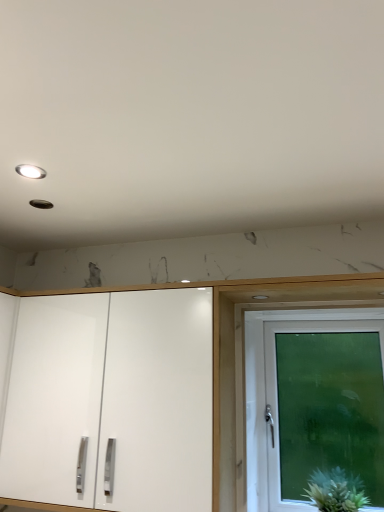
Question: Does white glossy cabinet doors at center appear on the right side of white glass door at right?

Choices:
 (A) no
 (B) yes

Answer: (A)

Question: From a real-world perspective, is white glossy cabinet doors at center under white glass door at right?

Choices:
 (A) no
 (B) yes

Answer: (A)

Question: Is white glass door at right a part of white glossy cabinet doors at center?

Choices:
 (A) no
 (B) yes

Answer: (A)

Question: Can you confirm if white glossy cabinet doors at center is shorter than white glass door at right?

Choices:
 (A) no
 (B) yes

Answer: (B)

Question: Is white glossy cabinet doors at center in front of white glass door at right?

Choices:
 (A) yes
 (B) no

Answer: (A)

Question: Is white glossy cabinet doors at center oriented away from white glass door at right?

Choices:
 (A) yes
 (B) no

Answer: (B)

Question: From the image's perspective, is matte white light fixture at upper left located beneath white glass door at right?

Choices:
 (A) yes
 (B) no

Answer: (B)

Question: From a real-world perspective, is matte white light fixture at upper left beneath white glass door at right?

Choices:
 (A) yes
 (B) no

Answer: (B)

Question: Considering the relative sizes of matte white light fixture at upper left and white glass door at right in the image provided, is matte white light fixture at upper left thinner than white glass door at right?

Choices:
 (A) no
 (B) yes

Answer: (B)

Question: Does matte white light fixture at upper left lie in front of white glass door at right?

Choices:
 (A) no
 (B) yes

Answer: (B)

Question: Does matte white light fixture at upper left appear on the right side of white glass door at right?

Choices:
 (A) yes
 (B) no

Answer: (B)

Question: Does matte white light fixture at upper left have a greater height compared to white glass door at right?

Choices:
 (A) yes
 (B) no

Answer: (B)

Question: Considering the relative sizes of white glossy cabinet doors at center and green fuzzy plant at lower right in the image provided, is white glossy cabinet doors at center shorter than green fuzzy plant at lower right?

Choices:
 (A) yes
 (B) no

Answer: (B)